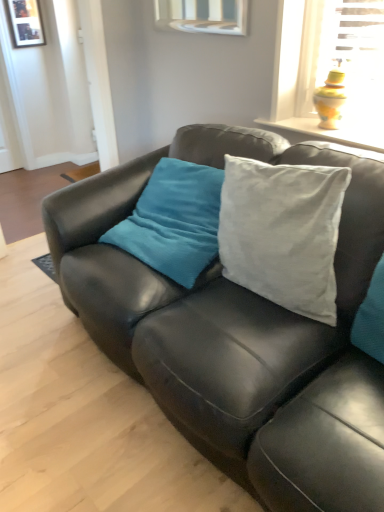
The width and height of the screenshot is (384, 512). What are the coordinates of `matte black couch at center` in the screenshot? It's located at (238, 333).

Image resolution: width=384 pixels, height=512 pixels. What do you see at coordinates (238, 333) in the screenshot? I see `matte black couch at center` at bounding box center [238, 333].

Measure the distance between matte black couch at center and camera.

A distance of 34.33 inches exists between matte black couch at center and camera.

Describe the element at coordinates (26, 23) in the screenshot. This screenshot has width=384, height=512. I see `wooden picture frame at upper left` at that location.

Locate an element on the screen. wooden picture frame at upper left is located at coordinates (26, 23).

You are a GUI agent. You are given a task and a screenshot of the screen. Output one action in this format:
    pyautogui.click(x=<x>, y=<y>)
    Task: Click on the matte black couch at center
    Image resolution: width=384 pixels, height=512 pixels.
    Given the screenshot: What is the action you would take?
    pyautogui.click(x=238, y=333)

Considering the relative positions of matte black couch at center and wooden picture frame at upper left in the image provided, is matte black couch at center to the left or to the right of wooden picture frame at upper left?

From the image, it's evident that matte black couch at center is to the right of wooden picture frame at upper left.

Which object is closer to the camera, matte black couch at center or wooden picture frame at upper left?

matte black couch at center is closer to the camera.

Which is less distant, (x=181, y=428) or (x=39, y=40)?

The point (x=181, y=428) is closer.

Looking at this image, from the image's perspective, is matte black couch at center beneath wooden picture frame at upper left?

Yes, from the image's perspective, matte black couch at center is beneath wooden picture frame at upper left.

From a real-world perspective, is matte black couch at center over wooden picture frame at upper left?

Actually, matte black couch at center is physically below wooden picture frame at upper left in the real world.

Which object is wider, matte black couch at center or wooden picture frame at upper left?

With larger width is matte black couch at center.

Between matte black couch at center and wooden picture frame at upper left, which one has less height?

wooden picture frame at upper left.

In the scene shown: Looking at the image, does matte black couch at center seem bigger or smaller compared to wooden picture frame at upper left?

Considering their sizes, matte black couch at center takes up more space than wooden picture frame at upper left.

Is matte black couch at center outside of wooden picture frame at upper left?

Yes, matte black couch at center is outside of wooden picture frame at upper left.

Can you see matte black couch at center touching wooden picture frame at upper left?

No, matte black couch at center is not with wooden picture frame at upper left.

Is matte black couch at center facing towards wooden picture frame at upper left?

No, matte black couch at center is not facing towards wooden picture frame at upper left.

Can you tell me how much matte black couch at center and wooden picture frame at upper left differ in facing direction?

86.4 degrees.

Locate an element on the screen. studio couch below the wooden picture frame at upper left (from the image's perspective) is located at coordinates (238, 333).

In the image, is wooden picture frame at upper left on the left side or the right side of matte black couch at center?

From the image, it's evident that wooden picture frame at upper left is to the left of matte black couch at center.

Which object is further away from the camera taking this photo, wooden picture frame at upper left or matte black couch at center?

wooden picture frame at upper left is more distant.

Which is behind, point (31, 27) or point (352, 219)?

The point (31, 27) is farther.

From the image's perspective, is wooden picture frame at upper left positioned above or below matte black couch at center?

Clearly, from the image's perspective, wooden picture frame at upper left is above matte black couch at center.

From a real-world perspective, is wooden picture frame at upper left over matte black couch at center?

Yes, from a real-world perspective, wooden picture frame at upper left is on top of matte black couch at center.

Looking at their sizes, would you say wooden picture frame at upper left is wider or thinner than matte black couch at center?

wooden picture frame at upper left is thinner than matte black couch at center.

Can you confirm if wooden picture frame at upper left is taller than matte black couch at center?

Incorrect, the height of wooden picture frame at upper left is not larger of that of matte black couch at center.

Based on their sizes in the image, would you say wooden picture frame at upper left is bigger or smaller than matte black couch at center?

In the image, wooden picture frame at upper left appears to be smaller than matte black couch at center.

Is wooden picture frame at upper left not within matte black couch at center?

Absolutely, wooden picture frame at upper left is external to matte black couch at center.

Does wooden picture frame at upper left touch matte black couch at center?

No.

Is wooden picture frame at upper left positioned with its back to matte black couch at center?

No, matte black couch at center is not at the back of wooden picture frame at upper left.

The width and height of the screenshot is (384, 512). I want to click on picture frame that is above the matte black couch at center (from a real-world perspective), so click(x=26, y=23).

Identify the location of studio couch on the right of wooden picture frame at upper left. This screenshot has height=512, width=384. (238, 333).

Identify the location of picture frame above the matte black couch at center (from a real-world perspective). (26, 23).